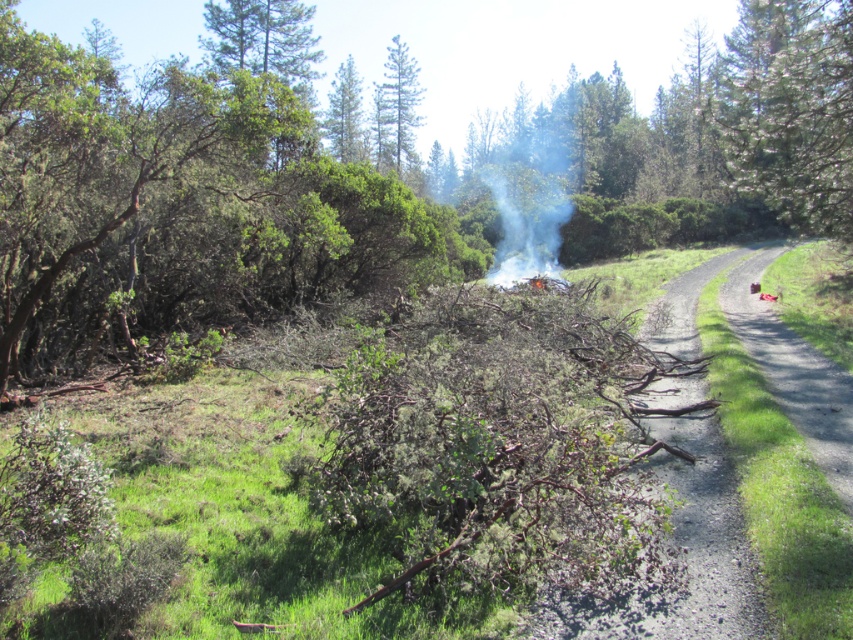
Question: Which point is closer to the camera taking this photo?

Choices:
 (A) (354, 96)
 (B) (703, 636)
 (C) (532, 205)

Answer: (B)

Question: Does white smoke at center have a greater width compared to green textured pine tree at upper center?

Choices:
 (A) no
 (B) yes

Answer: (B)

Question: Can you confirm if gravelly dirt road at center-right is bigger than green leafy tree at upper center?

Choices:
 (A) no
 (B) yes

Answer: (A)

Question: Can you confirm if gravelly dirt road at center-right is positioned above white smoke at center?

Choices:
 (A) yes
 (B) no

Answer: (B)

Question: Which object appears closest to the camera in this image?

Choices:
 (A) green textured pine tree at right
 (B) gravelly dirt road at center-right
 (C) green leafy tree at upper center

Answer: (B)

Question: Which point appears farthest from the camera in this image?

Choices:
 (A) (408, 96)
 (B) (352, 74)
 (C) (757, 589)
 (D) (560, 209)

Answer: (A)